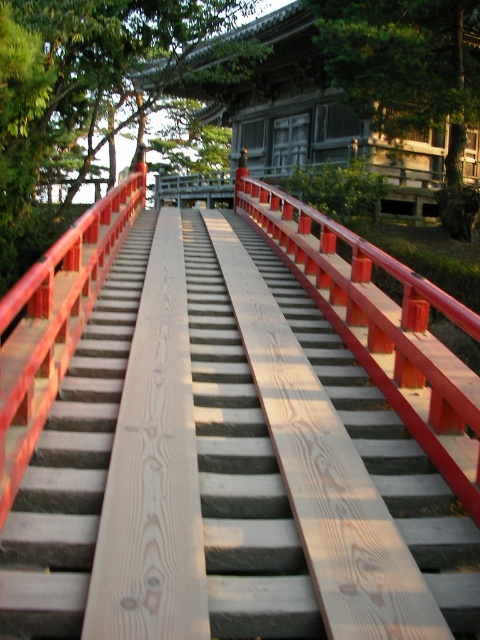
You are a visitor at the temple and want to take a photo of the wooden stairs at center and the green leafy tree at upper center in the same frame. Given that your camera has a maximum focus range of 10 meters, will you be able to capture both objects in one shot?

The wooden stairs at center is 11.13 meters away from the green leafy tree at upper center. Since the distance between them exceeds the camera maximum focus range of 10 meters, you might not be able to capture both in one clear shot.

You are standing on the wooden bridge and want to compare the sizes of the wooden stairs at center and the green leafy tree at upper center. Which one appears larger in the image?

The green leafy tree at upper center appears larger than the wooden stairs at center.

Based on the photo, you are standing on the wooden bridge and want to take a photo that includes both the wooden stairs at center and the green leafy tree at upper left. Which object should you position closer to the edge of the frame to ensure both are fully visible?

Since the wooden stairs at center is thinner than the green leafy tree at upper left, you should position the green leafy tree at upper left closer to the edge of the frame to ensure both are fully visible.